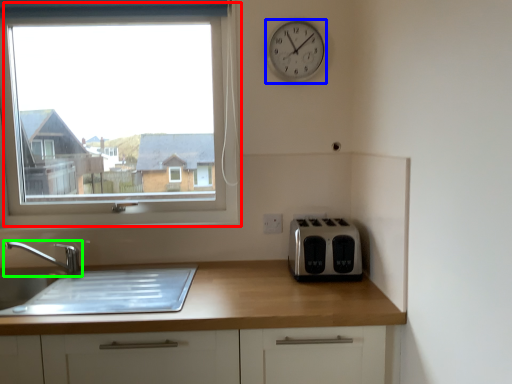
Question: Which object is the farthest from window (highlighted by a red box)? Choose among these: clock (highlighted by a blue box) or tap (highlighted by a green box).

Choices:
 (A) clock
 (B) tap

Answer: (A)